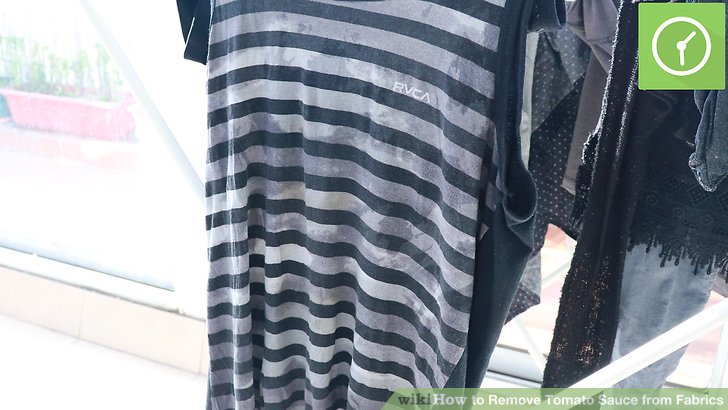
Locate an element on the screen. white bar of clothing rack is located at coordinates pos(694,330).